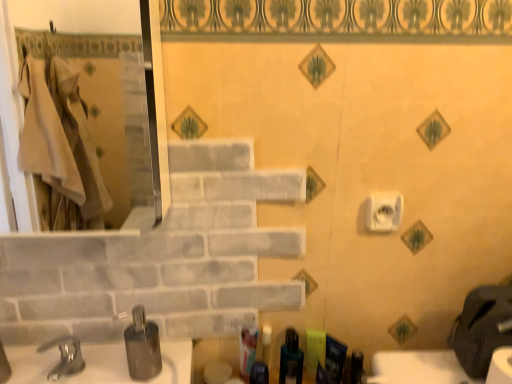
Question: Is translucent plastic toothbrush at lower center, the third toiletry positioned from the right, at the left side of blue matte toothpaste tube at lower right, which is the 1th toiletry from right to left?

Choices:
 (A) no
 (B) yes

Answer: (B)

Question: Is translucent plastic toothbrush at lower center, which is counted as the 4th toiletry, starting from the left, outside of blue matte toothpaste tube at lower right, which is the 1th toiletry from right to left?

Choices:
 (A) yes
 (B) no

Answer: (A)

Question: Is translucent plastic toothbrush at lower center, which is counted as the 4th toiletry, starting from the left, shorter than blue matte toothpaste tube at lower right, which is the 6th toiletry in left-to-right order?

Choices:
 (A) no
 (B) yes

Answer: (B)

Question: From the image's perspective, would you say translucent plastic toothbrush at lower center, which is counted as the 4th toiletry, starting from the left, is shown under blue matte toothpaste tube at lower right, which is the 1th toiletry from right to left?

Choices:
 (A) yes
 (B) no

Answer: (B)

Question: Is translucent plastic toothbrush at lower center, the third toiletry positioned from the right, further to the viewer compared to blue matte toothpaste tube at lower right, which is the 6th toiletry in left-to-right order?

Choices:
 (A) no
 (B) yes

Answer: (B)

Question: Which is correct: metallic silver soap dispenser at lower left is inside translucent plastic toothbrush at lower center, the 4th toiletry viewed from the right, or outside of it?

Choices:
 (A) outside
 (B) inside

Answer: (A)

Question: Is point tap(141, 311) closer or farther from the camera than point tap(262, 339)?

Choices:
 (A) farther
 (B) closer

Answer: (B)

Question: Considering the positions of metallic silver soap dispenser at lower left and translucent plastic toothbrush at lower center, positioned as the 3th toiletry in left-to-right order, in the image, is metallic silver soap dispenser at lower left bigger or smaller than translucent plastic toothbrush at lower center, positioned as the 3th toiletry in left-to-right order,?

Choices:
 (A) small
 (B) big

Answer: (B)

Question: Is metallic silver soap dispenser at lower left taller or shorter than translucent plastic toothbrush at lower center, positioned as the 3th toiletry in left-to-right order?

Choices:
 (A) tall
 (B) short

Answer: (A)

Question: Does point (141, 340) appear closer or farther from the camera than point (53, 6)?

Choices:
 (A) closer
 (B) farther

Answer: (A)

Question: Is metallic silver soap dispenser at lower left in front of or behind matte glass mirror at left in the image?

Choices:
 (A) behind
 (B) front

Answer: (A)

Question: Looking at their shapes, would you say metallic silver soap dispenser at lower left is wider or thinner than matte glass mirror at left?

Choices:
 (A) wide
 (B) thin

Answer: (B)

Question: In terms of size, does metallic silver soap dispenser at lower left appear bigger or smaller than matte glass mirror at left?

Choices:
 (A) small
 (B) big

Answer: (A)

Question: From the image's perspective, is matte green soap dispenser at center, placed as the 5th toiletry when sorted from left to right, above or below translucent plastic toothbrush at lower center, the 4th toiletry viewed from the right?

Choices:
 (A) above
 (B) below

Answer: (A)

Question: From a real-world perspective, is matte green soap dispenser at center, placed as the 5th toiletry when sorted from left to right, positioned above or below translucent plastic toothbrush at lower center, positioned as the 3th toiletry in left-to-right order?

Choices:
 (A) below
 (B) above

Answer: (B)